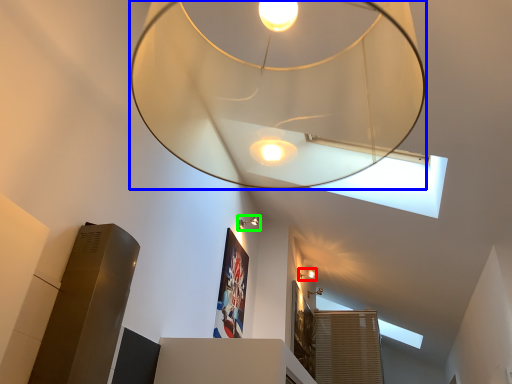
Question: Which is nearer to the lamp (highlighted by a red box)? lamp (highlighted by a blue box) or lamp (highlighted by a green box).

Choices:
 (A) lamp
 (B) lamp

Answer: (B)